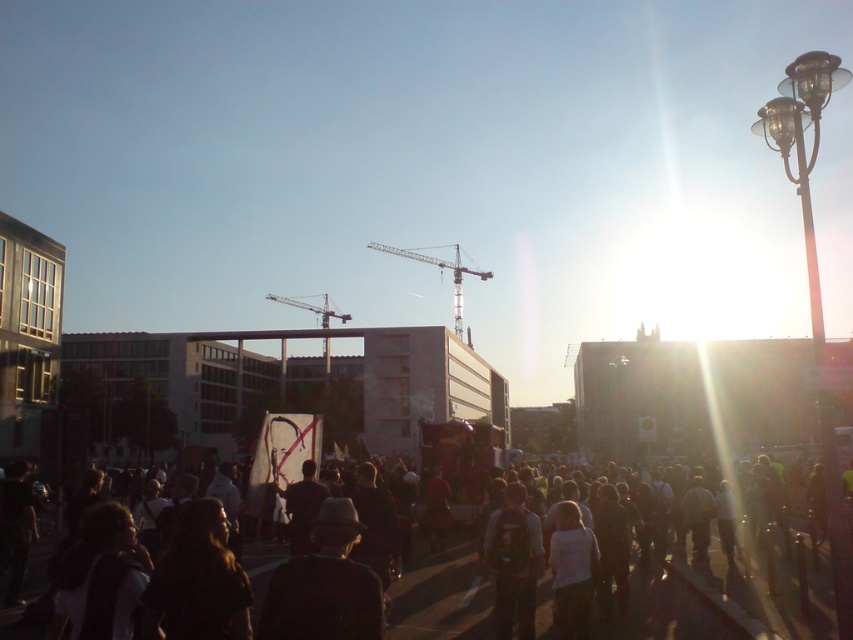
You are a photographer trying to capture a clear shot of the dark clothing at center and the dark brown leather hat at center. Since the sun is causing a lens flare on the right, which object should you position closer to the light source to avoid overexposure?

The dark clothing at center is taller than the dark brown leather hat at center, so positioning the dark clothing at center closer to the light source would help avoid overexposure since its height can block some of the light reaching the hat.